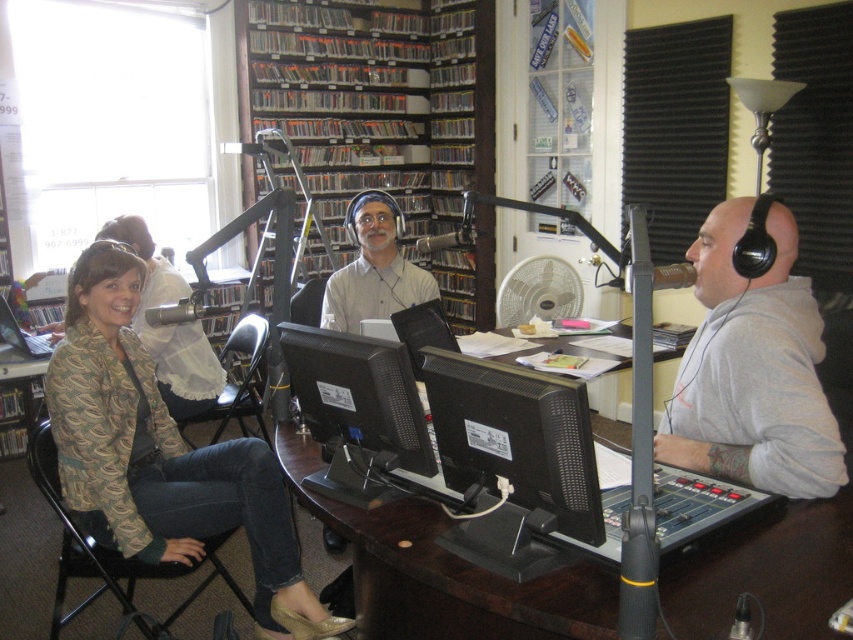
Which is below, patterned fabric jacket at left or black glossy monitor at center?

Positioned lower is patterned fabric jacket at left.

Is patterned fabric jacket at left above black glossy monitor at center?

No, patterned fabric jacket at left is not above black glossy monitor at center.

Find the location of a particular element. The image size is (853, 640). patterned fabric jacket at left is located at coordinates (161, 456).

Is black plastic computer desk at center above gray matte hoodie at right?

Actually, black plastic computer desk at center is below gray matte hoodie at right.

Is point (380, 556) more distant than point (801, 305)?

No.

This screenshot has width=853, height=640. What are the coordinates of `black plastic computer desk at center` in the screenshot? It's located at (444, 572).

Is point (815, 342) positioned after point (370, 307)?

No.

Is gray matte hoodie at right to the right of matte gray shirt at center from the viewer's perspective?

Correct, you'll find gray matte hoodie at right to the right of matte gray shirt at center.

Is point (775, 454) positioned before point (381, 284)?

Yes, it is in front of point (381, 284).

The image size is (853, 640). Find the location of `gray matte hoodie at right`. gray matte hoodie at right is located at coordinates (752, 369).